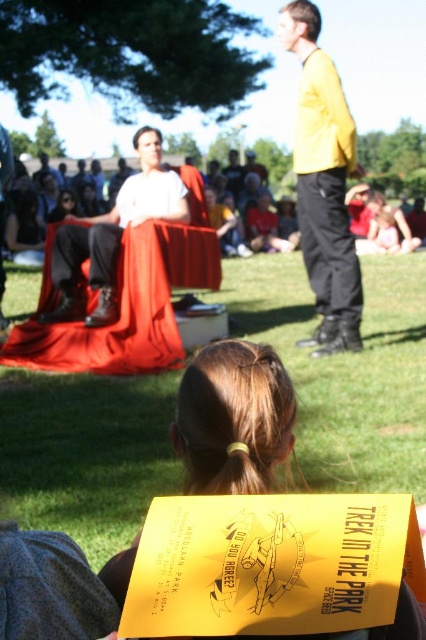
You are a photographer at the park event and need to capture a photo of the two main speakers. The brown hair at lower center and the matte white shirt at center are both in the frame. Which of these two has a narrower width in the photo?

The brown hair at lower center has a lesser width compared to the matte white shirt at center, so the brown hair at lower center is narrower in the photo.

You are attending an outdoor event at the park and see the green grass at center and the matte white shirt at center. Which object is closer to you?

The green grass at center is closer to you because it is in front of the matte white shirt at center.

You are a photographer at the park event. You need to capture a clear photo of both the brown hair at lower center and the matte white shirt at center. Which object should you focus on first to ensure both are in frame?

The brown hair at lower center is smaller in size compared to the matte white shirt at center. To ensure both are in frame, focus on the matte white shirt at center first as it is larger and easier to locate, then adjust to include the smaller brown hair at lower center.